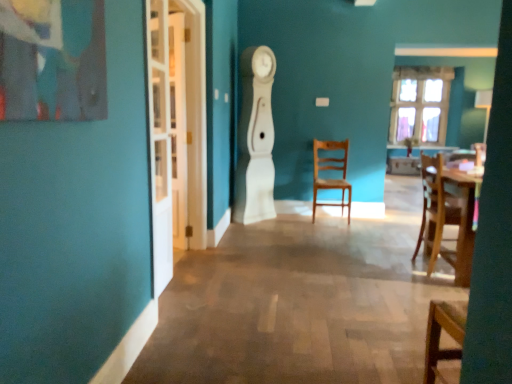
What is the approximate height of clear glass window at upper right?

clear glass window at upper right is 5.09 feet in height.

What do you see at coordinates (332, 170) in the screenshot? This screenshot has width=512, height=384. I see `wooden chair at center` at bounding box center [332, 170].

This screenshot has width=512, height=384. Find the location of `wooden table at right`. wooden table at right is located at coordinates (462, 223).

Measure the distance between point (158, 264) and camera.

Point (158, 264) and camera are 8.67 feet apart.

What is the approximate height of white glass door at left?

The height of white glass door at left is 6.82 feet.

This screenshot has width=512, height=384. Find the location of `white glossy clock at center`. white glossy clock at center is located at coordinates (256, 138).

Which of these two, white glass door at left or white glossy clock at center, is thinner?

white glass door at left is thinner.

Is the surface of white glass door at left in direct contact with white glossy clock at center?

No.

Measure the distance between white glass door at left and white glossy clock at center.

white glass door at left and white glossy clock at center are 6.35 feet apart.

From a real-world perspective, is white glass door at left under white glossy clock at center?

Indeed, from a real-world perspective, white glass door at left is positioned beneath white glossy clock at center.

In terms of height, does white glass door at left look taller or shorter compared to wooden table at right?

Considering their sizes, white glass door at left has more height than wooden table at right.

From the image's perspective, relative to wooden table at right, is white glass door at left above or below?

From the image's perspective, white glass door at left appears above wooden table at right.

Consider the image. Is white glass door at left positioned with its back to wooden table at right?

No, white glass door at left is not facing away from wooden table at right.

From a real-world perspective, is white glass door at left on clear glass window at upper right?

No, from a real-world perspective, white glass door at left is not over clear glass window at upper right

Considering the sizes of objects white glass door at left and clear glass window at upper right in the image provided, who is wider, white glass door at left or clear glass window at upper right?

With larger width is clear glass window at upper right.

Is white glass door at left spatially inside clear glass window at upper right, or outside of it?

white glass door at left is not enclosed by clear glass window at upper right.

From the image's perspective, which is below, white glass door at left or clear glass window at upper right?

white glass door at left appears lower in the image.

Visually, is white glass door at left positioned to the left or to the right of wooden chair at center?

white glass door at left is positioned on wooden chair at center's left side.

This screenshot has height=384, width=512. Identify the location of glass door above the wooden chair at center (from the image's perspective). (176, 131).

Is white glass door at left in front of or behind wooden chair at center in the image?

white glass door at left is in front of wooden chair at center.

From the image's perspective, does white glass door at left appear lower than wooden chair at center?

Actually, white glass door at left appears above wooden chair at center in the image.

Is white glossy clock at center far from clear glass window at upper right?

Yes, white glossy clock at center and clear glass window at upper right are quite far apart.

Who is smaller, white glossy clock at center or clear glass window at upper right?

clear glass window at upper right.

Consider the image. Is white glossy clock at center facing away from clear glass window at upper right?

No.

Which object is further away from the camera taking this photo, white glossy clock at center or clear glass window at upper right?

clear glass window at upper right is further away from the camera.

How many degrees apart are the facing directions of clear glass window at upper right and wooden chair at center?

clear glass window at upper right and wooden chair at center are facing 1.35 degrees away from each other.

Would you consider clear glass window at upper right to be distant from wooden chair at center?

Yes, clear glass window at upper right and wooden chair at center are located far from each other.

Is point (444, 100) positioned after point (319, 159)?

Yes, point (444, 100) is farther from viewer.

Between clear glass window at upper right and wooden chair at center, which one has smaller size?

With smaller size is wooden chair at center.

Which is more to the left, white glass door at left or white glossy clock at center?

white glass door at left is more to the left.

Find the location of a particular element. wide lying behind the white glass door at left is located at coordinates (256, 138).

Would you say white glass door at left is inside or outside white glossy clock at center?

white glass door at left is not inside white glossy clock at center, it's outside.

From a real-world perspective, is white glass door at left located higher than white glossy clock at center?

Indeed, from a real-world perspective, white glass door at left stands above white glossy clock at center.

Locate an element on the screen. wide lying behind the white glass door at left is located at coordinates (256, 138).

The image size is (512, 384). I want to click on table that is below the white glass door at left (from the image's perspective), so click(x=462, y=223).

Based on their spatial positions, is wooden chair at center or clear glass window at upper right closer to white glossy clock at center?

Based on the image, wooden chair at center appears to be nearer to white glossy clock at center.

Looking at the image, which one is located closer to white glass door at left, wooden chair at center or wooden table at right?

Among the two, wooden table at right is located nearer to white glass door at left.

Considering their positions, is white glass door at left positioned closer to clear glass window at upper right than white glass door at left?

The object closer to clear glass window at upper right is white glass door at left.

Based on their spatial positions, is clear glass window at upper right or white glossy clock at center further from wooden chair at center?

clear glass window at upper right.

Estimate the real-world distances between objects in this image. Which object is closer to wooden chair at center, wooden table at right or clear glass window at upper right?

The object closer to wooden chair at center is wooden table at right.

Based on their spatial positions, is wooden chair at center or wooden table at right further from white glossy clock at center?

Among the two, wooden table at right is located further to white glossy clock at center.

Estimate the real-world distances between objects in this image. Which object is closer to clear glass window at upper right, white glossy clock at center or wooden chair at center?

The object closer to clear glass window at upper right is wooden chair at center.

Estimate the real-world distances between objects in this image. Which object is closer to white glass door at left, clear glass window at upper right or wooden table at right?

Based on the image, wooden table at right appears to be nearer to white glass door at left.

Locate an element on the screen. This screenshot has width=512, height=384. chair between white glossy clock at center and clear glass window at upper right in the front-back direction is located at coordinates (332, 170).

Image resolution: width=512 pixels, height=384 pixels. I want to click on table between white glass door at left and white glossy clock at center along the z-axis, so click(462, 223).

Image resolution: width=512 pixels, height=384 pixels. What are the coordinates of `glass door between white glass door at left and wooden table at right from left to right` in the screenshot? It's located at (176, 131).

The width and height of the screenshot is (512, 384). Identify the location of door located between white glass door at left and white glossy clock at center in the depth direction. tap(160, 141).